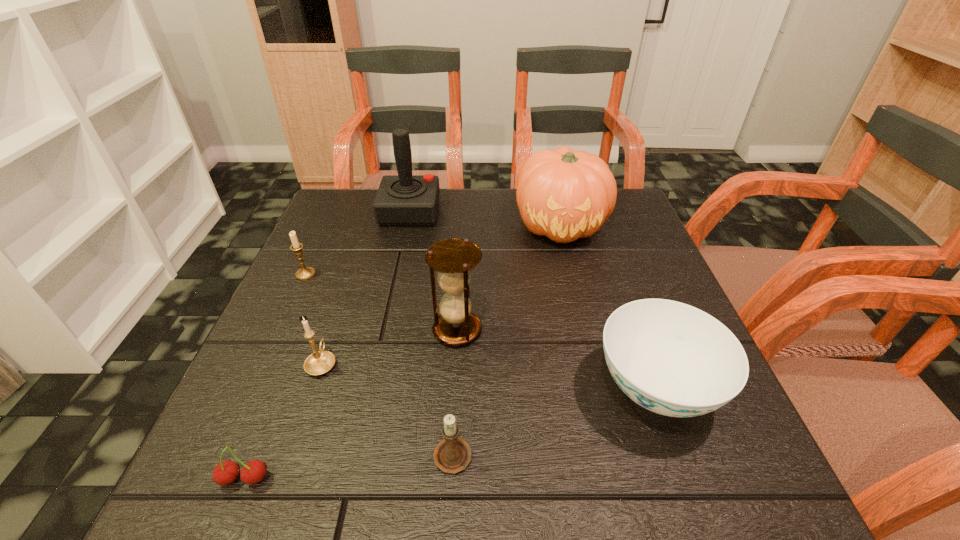
The width and height of the screenshot is (960, 540). Find the location of `vacant area that lies between the second farthest candle holder and the cherry`. vacant area that lies between the second farthest candle holder and the cherry is located at coordinates coord(283,421).

Where is `free space that is in between the rightmost candle holder and the second farthest candle holder`? This screenshot has height=540, width=960. free space that is in between the rightmost candle holder and the second farthest candle holder is located at coordinates (387, 408).

Find the location of `free space that is in between the nearest candle holder and the chinaware`. free space that is in between the nearest candle holder and the chinaware is located at coordinates (554, 420).

Find the location of `empty space between the nearest candle holder and the joystick`. empty space between the nearest candle holder and the joystick is located at coordinates (431, 332).

At what (x,y) coordinates should I click in order to perform the action: click on vacant point located between the chinaware and the hourglass. Please return your answer as a coordinate pair (x, y). Looking at the image, I should click on (557, 359).

In order to click on vacant region between the chinaware and the nearest candle holder in this screenshot , I will do `click(554, 420)`.

Image resolution: width=960 pixels, height=540 pixels. I want to click on free spot between the second candle holder from right to left and the hourglass, so click(x=390, y=347).

Where is `object that stands as the seventh closest to the chinaware`? This screenshot has height=540, width=960. object that stands as the seventh closest to the chinaware is located at coordinates (305, 273).

Choose which object is the second nearest neighbor to the hourglass. Please provide its 2D coordinates. Your answer should be formatted as a tuple, i.e. [(x, y)], where the tuple contains the x and y coordinates of a point satisfying the conditions above.

[(320, 362)]

Locate an element on the screen. Image resolution: width=960 pixels, height=540 pixels. candle holder that is the nearest to the cherry is located at coordinates (320, 362).